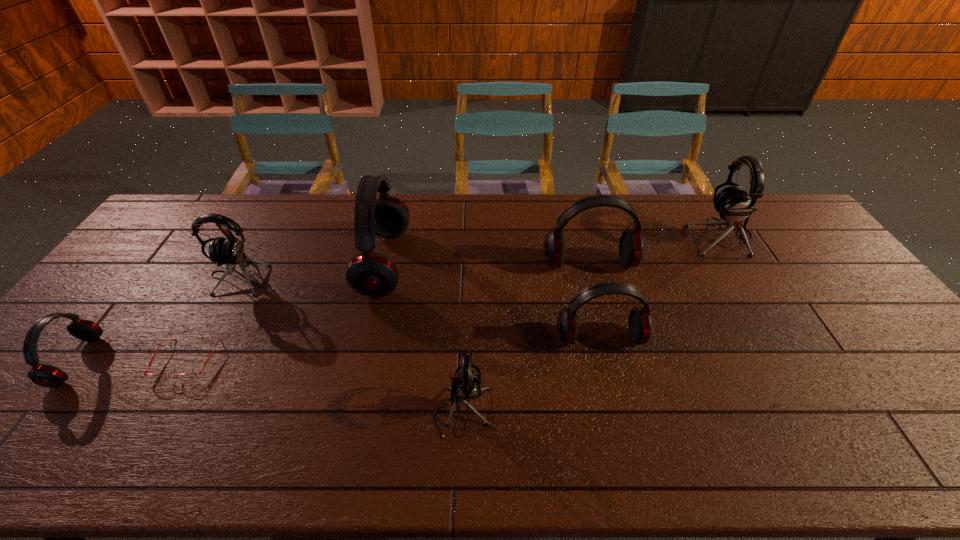
You are a GUI agent. You are given a task and a screenshot of the screen. Output one action in this format:
    pyautogui.click(x=<x>, y=<y>)
    Task: Click on the vacant region located on the ear cups of the leftmost red earphone
    The width and height of the screenshot is (960, 540).
    Given the screenshot: What is the action you would take?
    [138, 361]

Identify the location of free space located 0.140m on the lenses of the shortest object. Image resolution: width=960 pixels, height=540 pixels. (142, 438).

Locate an element on the screen. The width and height of the screenshot is (960, 540). object present at the near edge is located at coordinates (465, 387).

Identify the location of object at the left edge. This screenshot has width=960, height=540. (44, 375).

Where is `free location at the far edge`? The height and width of the screenshot is (540, 960). free location at the far edge is located at coordinates (526, 206).

Find the location of a particular element. The height and width of the screenshot is (540, 960). blank space at the near edge of the desktop is located at coordinates (399, 439).

Image resolution: width=960 pixels, height=540 pixels. Find the location of `vacant space at the left edge of the desktop`. vacant space at the left edge of the desktop is located at coordinates (138, 248).

In order to click on blank space at the right edge of the desktop in this screenshot , I will do `click(895, 363)`.

Where is `free spot between the nearest black earphone and the shortest object`? free spot between the nearest black earphone and the shortest object is located at coordinates (324, 386).

Where is `vacant space that's between the fourth earphone from right to left and the spectacles`? This screenshot has width=960, height=540. vacant space that's between the fourth earphone from right to left and the spectacles is located at coordinates (324, 386).